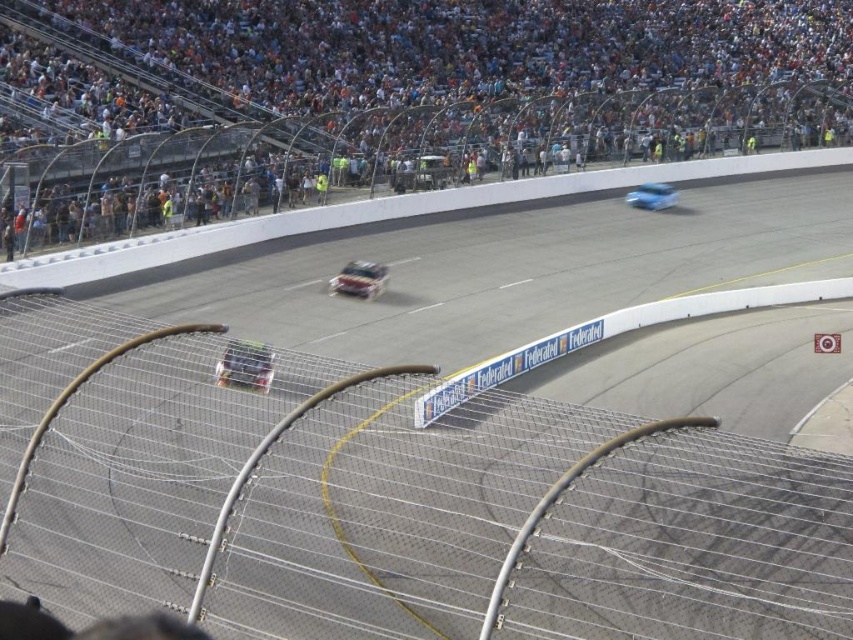
You are a photographer at the racetrack and want to capture a photo of the shiny silver race car at center without any obstructions. Given the presence of the white plastic crowd at upper left, is there a position you can move to where the car is visible without the crowd blocking it?

The shiny silver race car at center is behind the white plastic crowd at upper left, so moving to a position where you can angle your camera downward or shift your viewpoint to the right might allow you to capture the car without the crowd obstructing it.

You are a photographer at the racetrack and want to capture a photo that includes both the white plastic crowd at upper left and the shiny silver race car at center. Based on their positions, which object should you adjust your camera angle to focus on first to ensure both are in frame?

The white plastic crowd at upper left is located above the shiny silver race car at center, so you should adjust your camera angle to focus on the white plastic crowd at upper left first to ensure both are in frame.